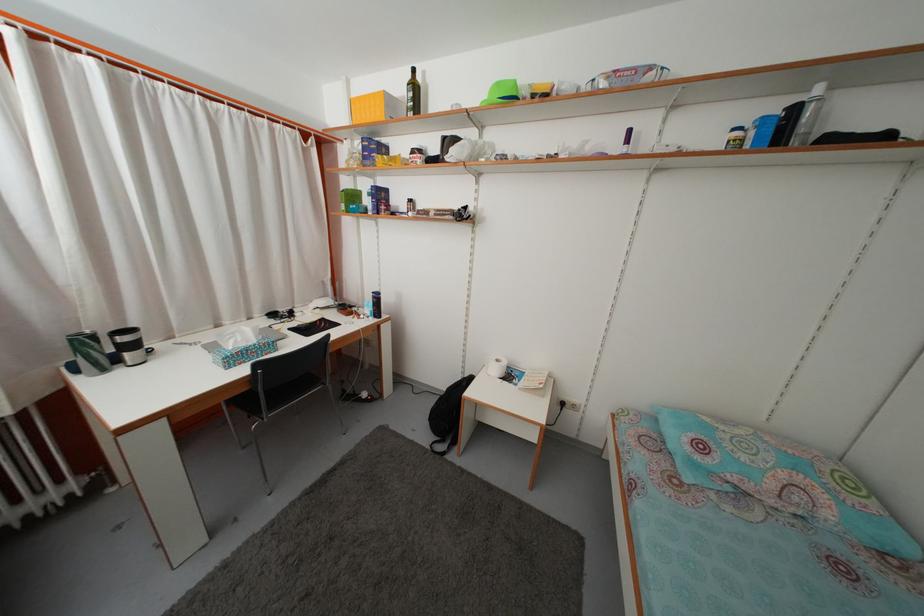
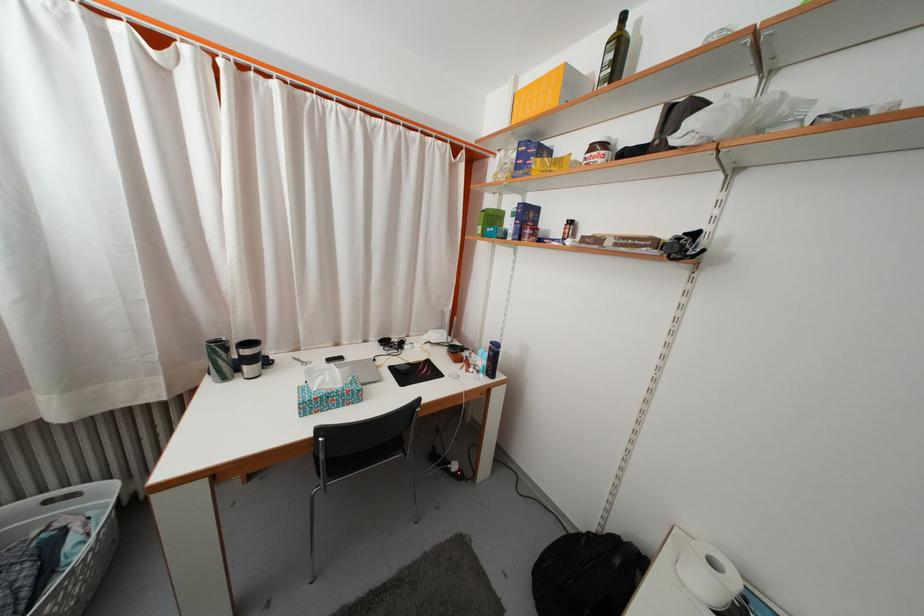
Where in the second image is the point corresponding to point 420,95 from the first image?

(625, 54)